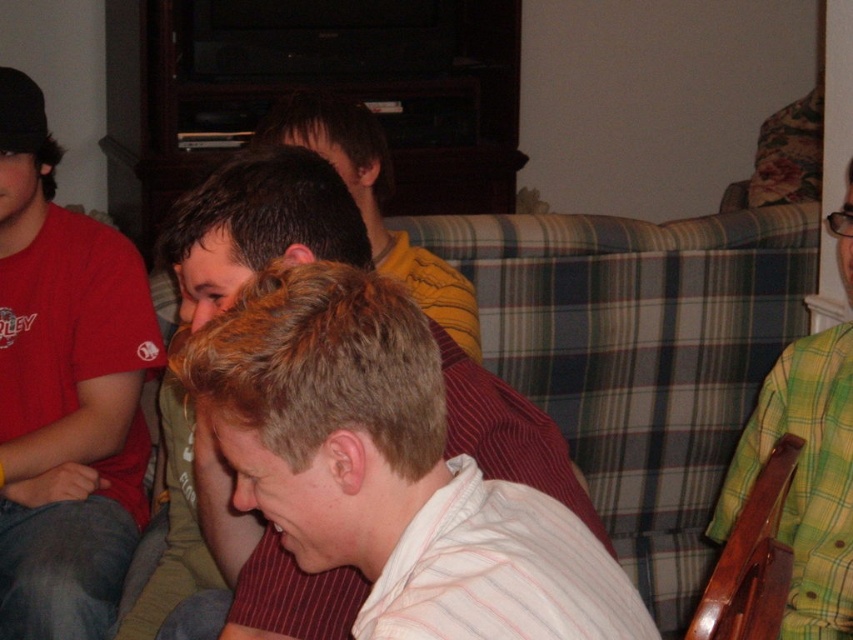
Question: Can you confirm if matte red t-shirt at left is positioned to the right of light brown striped shirt at center?

Choices:
 (A) no
 (B) yes

Answer: (A)

Question: Which object is closer to the camera taking this photo?

Choices:
 (A) light brown striped shirt at center
 (B) green plaid shirt at right

Answer: (A)

Question: Is light brown striped shirt at center bigger than green plaid shirt at right?

Choices:
 (A) yes
 (B) no

Answer: (A)

Question: Is matte red t-shirt at left to the left of green plaid shirt at right from the viewer's perspective?

Choices:
 (A) no
 (B) yes

Answer: (B)

Question: Which object is farther from the camera taking this photo?

Choices:
 (A) matte red t-shirt at left
 (B) green plaid shirt at right
 (C) light brown striped shirt at center

Answer: (A)

Question: Estimate the real-world distances between objects in this image. Which object is closer to the light brown striped shirt at center?

Choices:
 (A) matte red t-shirt at left
 (B) green plaid shirt at right

Answer: (A)